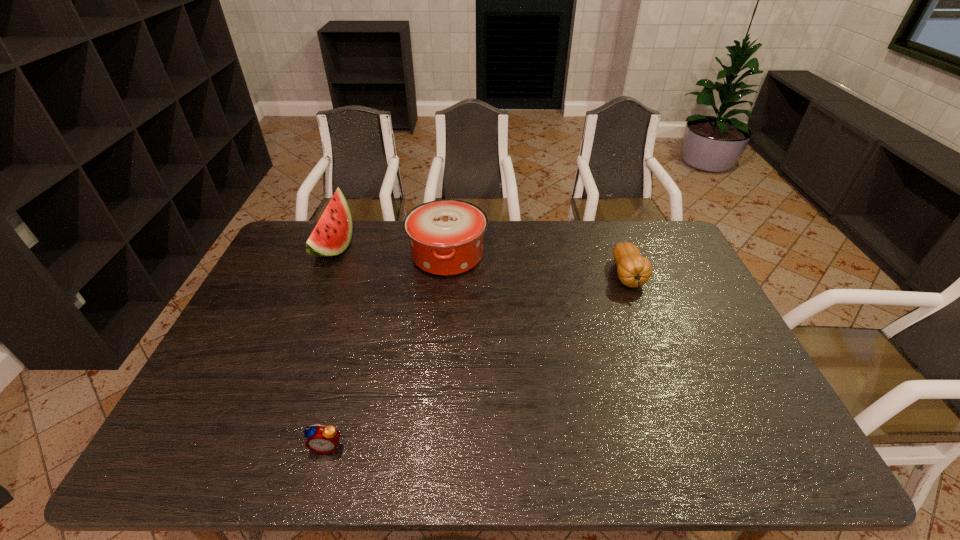
Identify which object is the second closest to the gourd. Please provide its 2D coordinates. Your answer should be formatted as a tuple, i.e. [(x, y)], where the tuple contains the x and y coordinates of a point satisfying the conditions above.

[(322, 439)]

In order to click on free location that satisfies the following two spatial constraints: 1. on the outer rind of the third object from left to right; 2. on the right side of the watermelon in this screenshot , I will do `click(330, 255)`.

This screenshot has width=960, height=540. I want to click on vacant region that satisfies the following two spatial constraints: 1. on the back side of the second object from right to left; 2. on the outer rind of the leftmost object, so click(x=448, y=248).

The width and height of the screenshot is (960, 540). In order to click on vacant point that satisfies the following two spatial constraints: 1. on the outer rind of the watermelon; 2. on the right side of the second object from right to left in this screenshot , I will do `click(330, 255)`.

Find the location of a particular element. This screenshot has width=960, height=540. vacant point that satisfies the following two spatial constraints: 1. on the outer rind of the second object from right to left; 2. on the left side of the leftmost object is located at coordinates (330, 255).

Locate an element on the screen. This screenshot has width=960, height=540. vacant region that satisfies the following two spatial constraints: 1. on the outer rind of the leftmost object; 2. on the left side of the second object from right to left is located at coordinates (330, 255).

Identify the location of free space that satisfies the following two spatial constraints: 1. on the outer rind of the leftmost object; 2. on the back side of the third object from left to right. The image size is (960, 540). (x=330, y=255).